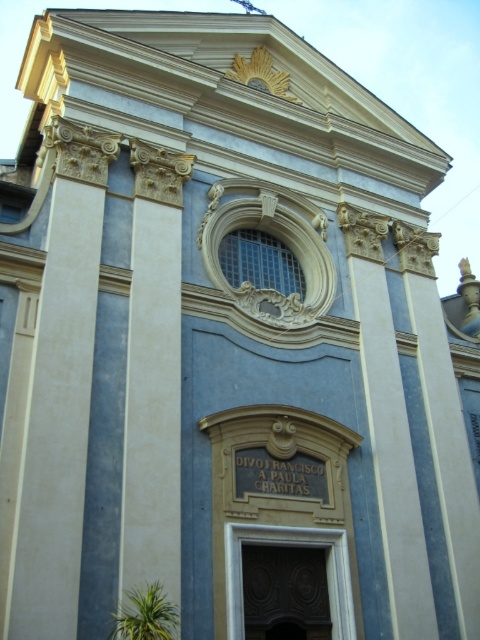
Can you confirm if white plaster column at left is wider than dark wood carved door at center?

Yes.

Can you confirm if white plaster column at left is bigger than dark wood carved door at center?

Yes, white plaster column at left is bigger than dark wood carved door at center.

Is point (167, 260) closer to camera compared to point (283, 637)?

No, it is behind (283, 637).

Locate an element on the screen. Image resolution: width=480 pixels, height=640 pixels. white plaster column at left is located at coordinates (154, 376).